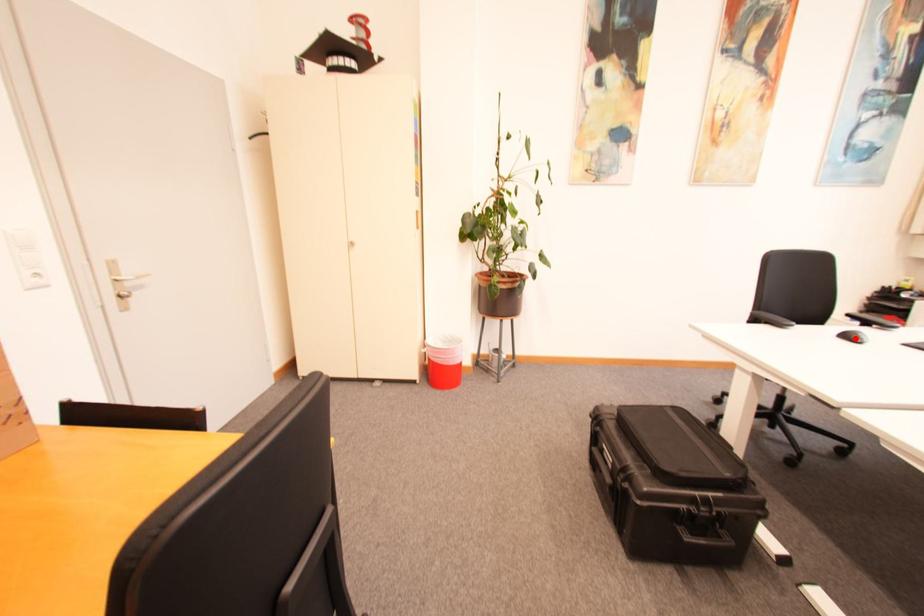
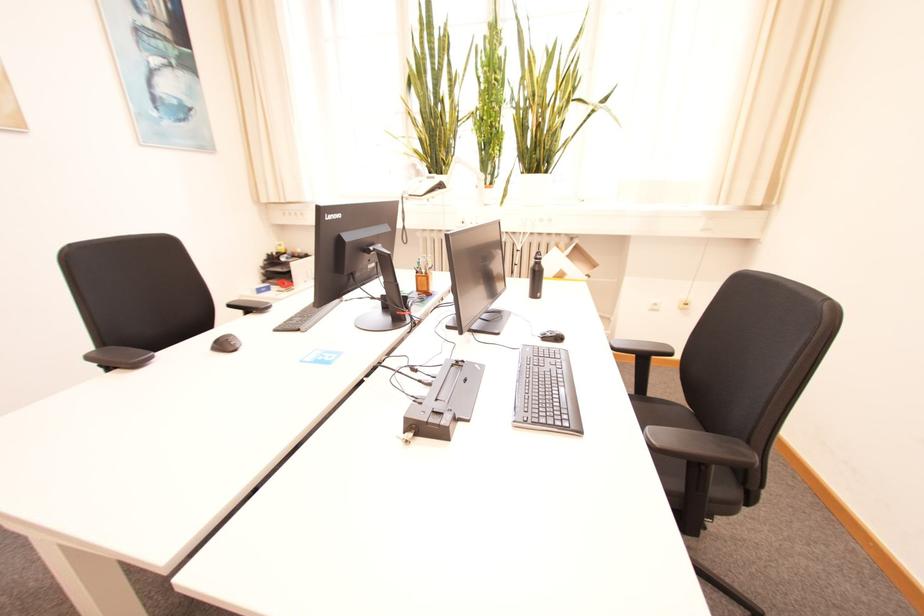
In the second image, find the point that corresponds to the highlighted location in the first image.

(229, 346)